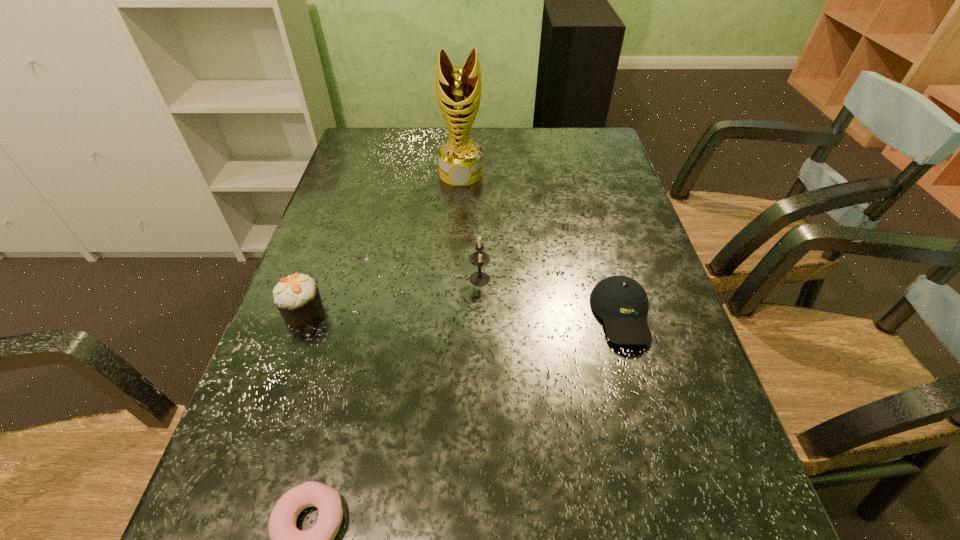
Identify the location of vacant point located between the award and the fourth tallest object. This screenshot has width=960, height=540. (541, 245).

This screenshot has height=540, width=960. In order to click on free space that is in between the leftmost object and the baseball cap in this screenshot , I will do `click(463, 313)`.

Where is `vacant space that's between the cupcake and the second shortest object`? vacant space that's between the cupcake and the second shortest object is located at coordinates (463, 313).

Find the location of a particular element. This screenshot has width=960, height=540. free space that is in between the second shortest object and the leftmost object is located at coordinates (463, 313).

Find the location of `vacant area between the farthest object and the third tallest object`. vacant area between the farthest object and the third tallest object is located at coordinates click(x=382, y=242).

Locate which object ranks third in proximity to the third tallest object. Please provide its 2D coordinates. Your answer should be formatted as a tuple, i.e. [(x, y)], where the tuple contains the x and y coordinates of a point satisfying the conditions above.

[(458, 89)]

Locate which object is the third closest to the shortest object. Please provide its 2D coordinates. Your answer should be formatted as a tuple, i.e. [(x, y)], where the tuple contains the x and y coordinates of a point satisfying the conditions above.

[(621, 302)]

Locate an element on the screen. This screenshot has height=540, width=960. free space that satisfies the following two spatial constraints: 1. on the back side of the fourth shortest object; 2. on the left side of the third tallest object is located at coordinates (315, 279).

Where is `free spot that satisfies the following two spatial constraints: 1. on the front-facing side of the farthest object; 2. on the right side of the second tallest object`? free spot that satisfies the following two spatial constraints: 1. on the front-facing side of the farthest object; 2. on the right side of the second tallest object is located at coordinates (455, 279).

You are a GUI agent. You are given a task and a screenshot of the screen. Output one action in this format:
    pyautogui.click(x=<x>, y=<y>)
    Task: Click on the vacant space that satisfies the following two spatial constraints: 1. on the front-facing side of the award; 2. on the left side of the candle holder
    
    Given the screenshot: What is the action you would take?
    pyautogui.click(x=455, y=279)